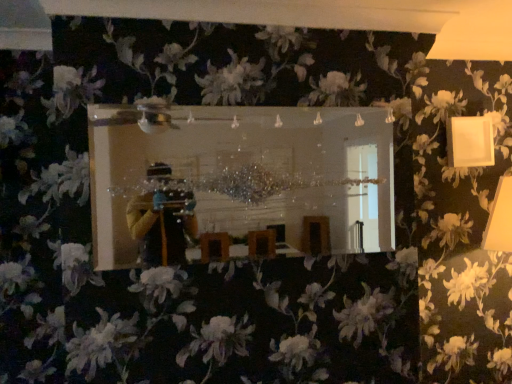
What do you see at coordinates (249, 175) in the screenshot?
I see `clear glass mirror at center` at bounding box center [249, 175].

At what (x,y) coordinates should I click in order to perform the action: click on clear glass mirror at center. Please return your answer as a coordinate pair (x, y). Looking at the image, I should click on [249, 175].

In the scene shown: What is the approximate height of clear glass mirror at center?

The height of clear glass mirror at center is 25.23 inches.

I want to click on clear glass mirror at center, so click(x=249, y=175).